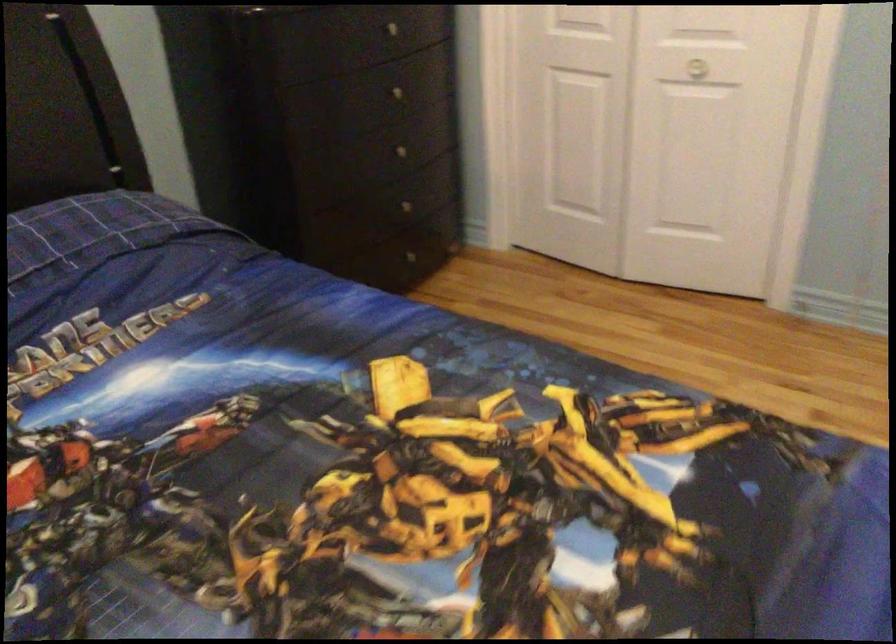
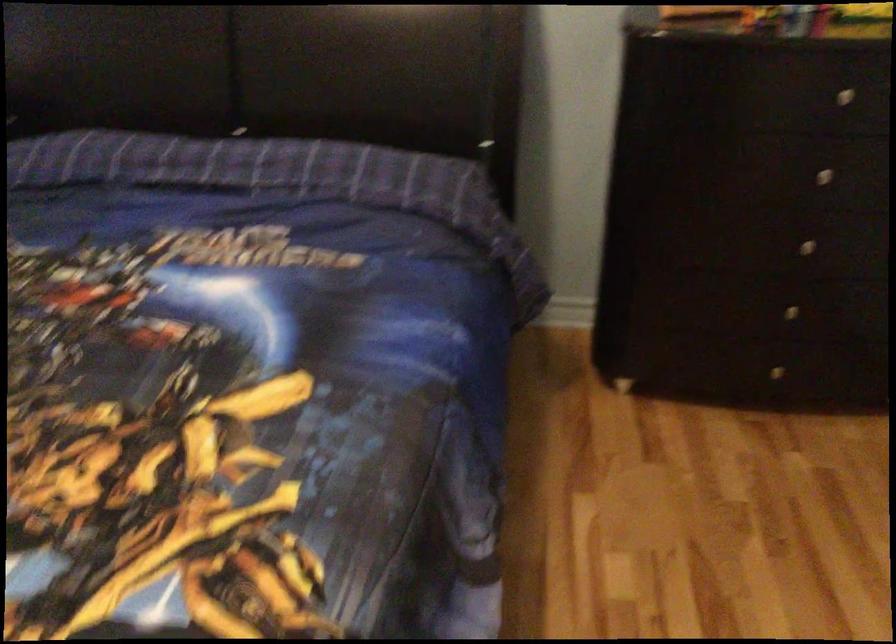
The point at (400, 87) is marked in the first image. Where is the corresponding point in the second image?

(833, 169)